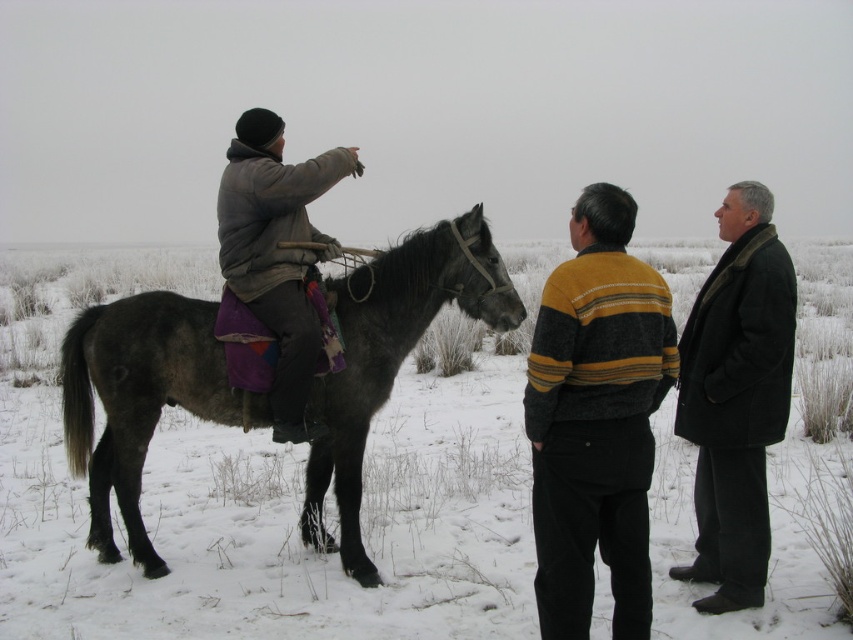
Question: Estimate the real-world distances between objects in this image. Which object is closer to the dark gray wool coat at right?

Choices:
 (A) striped wool sweater at center
 (B) dark gray fur horse at left
 (C) gray woolen jacket at left

Answer: (A)

Question: Among these objects, which one is farthest from the camera?

Choices:
 (A) gray woolen jacket at left
 (B) dark gray fur horse at left

Answer: (A)

Question: Does dark gray fur horse at left lie behind striped wool sweater at center?

Choices:
 (A) no
 (B) yes

Answer: (B)

Question: Which point is farther to the camera?

Choices:
 (A) dark gray wool coat at right
 (B) dark gray fur horse at left

Answer: (B)

Question: Can you confirm if dark gray wool coat at right is bigger than gray woolen jacket at left?

Choices:
 (A) yes
 (B) no

Answer: (A)

Question: Is dark gray fur horse at left above striped wool sweater at center?

Choices:
 (A) no
 (B) yes

Answer: (A)